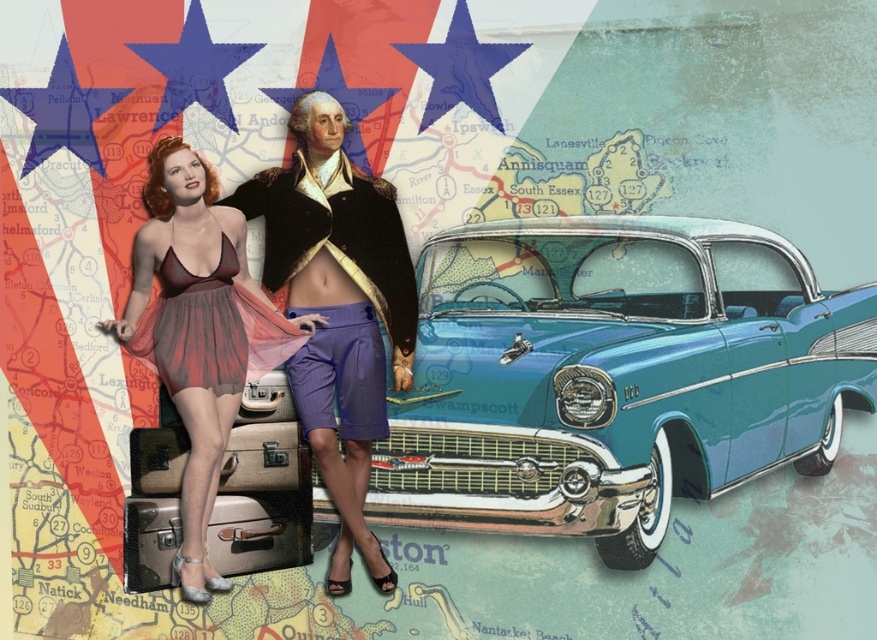
You are organizing a beach day and need to pack a metallic suitcase at center and a matte purple bikini top at left. Which item should you place first into your luggage to ensure the taller item is packed properly?

You should place the metallic suitcase at center first because it is taller than the matte purple bikini top at left, allowing it to be packed in a way that accommodates its height.